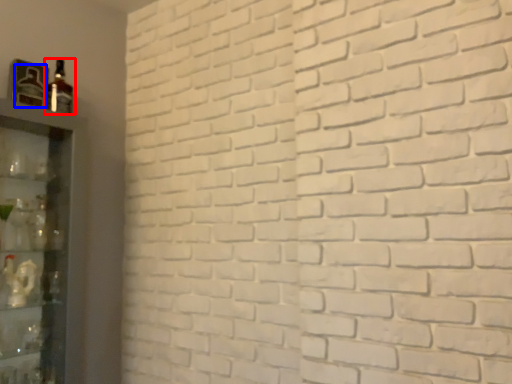
Question: Which of the following is the farthest to the observer, bottle (highlighted by a red box) or bottle (highlighted by a blue box)?

Choices:
 (A) bottle
 (B) bottle

Answer: (A)